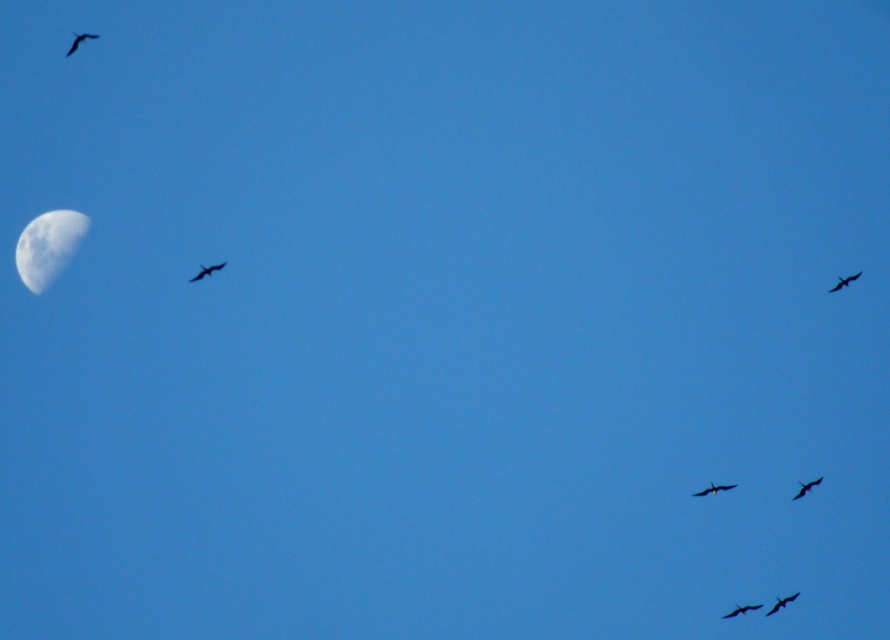
Question: Which point is farther to the camera?

Choices:
 (A) smooth black bird at lower right
 (B) shiny black bird at upper right
 (C) silhouette glossy bird at upper left
 (D) silhouette glossy bird at lower right

Answer: (A)

Question: Which point is closer to the camera?

Choices:
 (A) smooth black bird at lower right
 (B) shiny black bird at lower right

Answer: (B)

Question: Does dark feathered bird at lower right have a greater width compared to silhouette glossy bird at lower right?

Choices:
 (A) no
 (B) yes

Answer: (A)

Question: Is shiny black bird at lower right smaller than smooth black bird at lower right?

Choices:
 (A) no
 (B) yes

Answer: (A)

Question: Which of the following is the closest to the observer?

Choices:
 (A) (726, 614)
 (B) (846, 284)
 (C) (207, 266)

Answer: (C)

Question: Considering the relative positions of silhouette glossy bird at lower right and shiny black bird at lower right in the image provided, where is silhouette glossy bird at lower right located with respect to shiny black bird at lower right?

Choices:
 (A) left
 (B) right

Answer: (A)